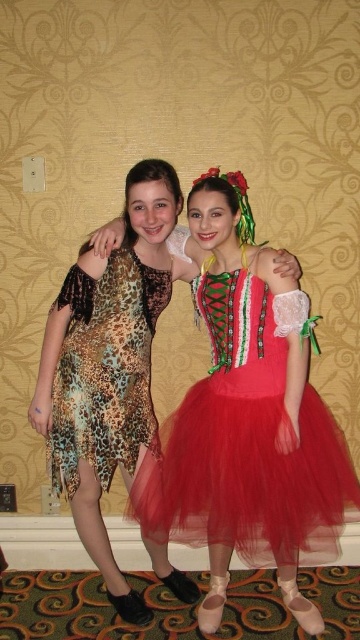
You are standing in a room with two people. There is a point marked at coordinates [96,353]. Can you reach this point without moving closer to the people?

The point marked at coordinates [96,353] is 6.97 feet away from the viewer, so yes, you can reach it without moving closer to the people since it is at a distance that allows access without proximity.

You are taking a photo of the two dresses in the image. The red tulle dress at center and the leopard print dress at center. Which dress should you focus on first to ensure it is in sharp focus?

The red tulle dress at center is closer to the viewer than the leopard print dress at center, so you should focus on the red tulle dress at center first to ensure it is in sharp focus.